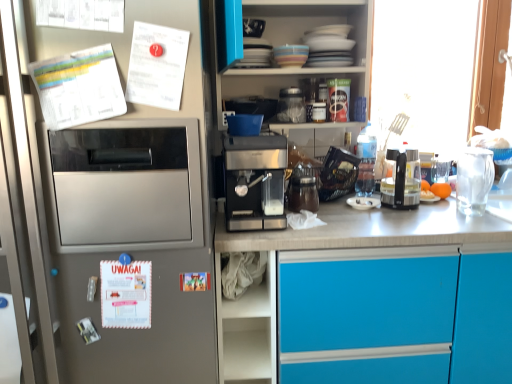
Question: Can you confirm if white fabric at lower center is smaller than satin silver refrigerator at left?

Choices:
 (A) no
 (B) yes

Answer: (B)

Question: Is white fabric at lower center next to satin silver refrigerator at left?

Choices:
 (A) yes
 (B) no

Answer: (B)

Question: Can you confirm if white fabric at lower center is taller than satin silver refrigerator at left?

Choices:
 (A) no
 (B) yes

Answer: (A)

Question: Is white fabric at lower center outside satin silver refrigerator at left?

Choices:
 (A) yes
 (B) no

Answer: (A)

Question: Would you say satin silver refrigerator at left is part of white fabric at lower center's contents?

Choices:
 (A) yes
 (B) no

Answer: (B)

Question: Based on their positions, is brown matte jar at center, marked as the 3th appliance in a top-to-bottom arrangement, located to the left or right of orange matte fruit at right?

Choices:
 (A) left
 (B) right

Answer: (A)

Question: Considering the positions of point (300, 193) and point (423, 192), is point (300, 193) closer or farther from the camera than point (423, 192)?

Choices:
 (A) farther
 (B) closer

Answer: (B)

Question: Is brown matte jar at center, marked as the 1th appliance in a bottom-to-top arrangement, in front of or behind orange matte fruit at right in the image?

Choices:
 (A) front
 (B) behind

Answer: (A)

Question: From a real-world perspective, relative to orange matte fruit at right, is brown matte jar at center, marked as the 3th appliance in a top-to-bottom arrangement, vertically above or below?

Choices:
 (A) above
 (B) below

Answer: (A)

Question: Considering the positions of blue matte cabinet at center and white paper at left, which is counted as the 3th postcard, starting from the top, in the image, is blue matte cabinet at center wider or thinner than white paper at left, which is counted as the 3th postcard, starting from the top,?

Choices:
 (A) wide
 (B) thin

Answer: (A)

Question: Is blue matte cabinet at center inside or outside of white paper at left, the 1th postcard when ordered from bottom to top?

Choices:
 (A) inside
 (B) outside

Answer: (B)

Question: From a real-world perspective, is blue matte cabinet at center positioned above or below white paper at left, which is counted as the 3th postcard, starting from the top?

Choices:
 (A) below
 (B) above

Answer: (A)

Question: Considering the relative positions of blue matte cabinet at center and white paper at left, which is counted as the 3th postcard, starting from the top, in the image provided, is blue matte cabinet at center to the left or to the right of white paper at left, which is counted as the 3th postcard, starting from the top,?

Choices:
 (A) right
 (B) left

Answer: (A)

Question: From a real-world perspective, is transparent glass window at right above or below white paper at left, the second postcard from the bottom?

Choices:
 (A) below
 (B) above

Answer: (A)

Question: Considering the positions of point (453, 89) and point (108, 54), is point (453, 89) closer or farther from the camera than point (108, 54)?

Choices:
 (A) farther
 (B) closer

Answer: (A)